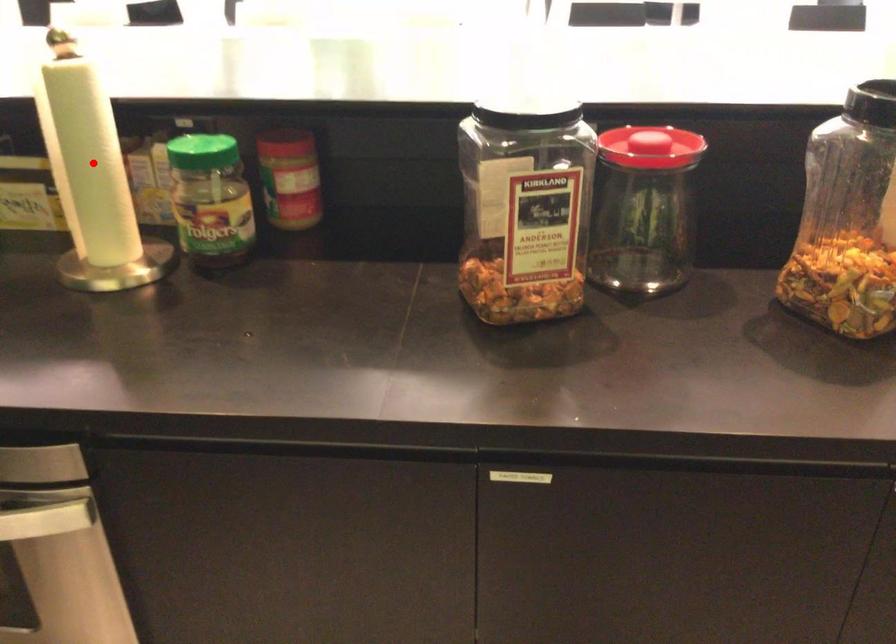
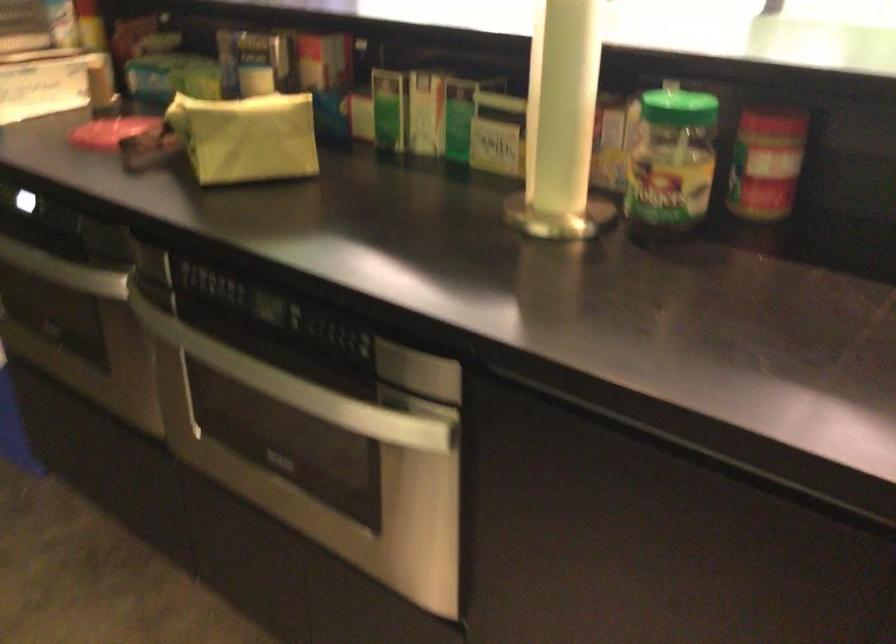
In the second image, find the point that corresponds to the highlighted location in the first image.

(563, 102)